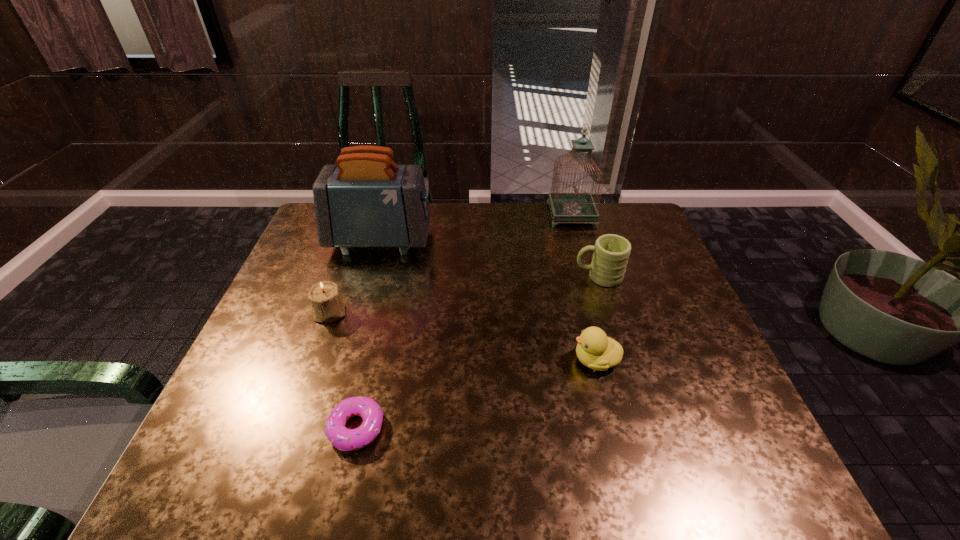
Where is `vacant region between the doughnut and the second shortest object`? vacant region between the doughnut and the second shortest object is located at coordinates (476, 394).

Where is `vacant region between the birdcage and the mug`? The width and height of the screenshot is (960, 540). vacant region between the birdcage and the mug is located at coordinates (585, 246).

Where is `free space between the birdcage and the duckling`? The image size is (960, 540). free space between the birdcage and the duckling is located at coordinates (584, 287).

Identify which object is located as the third nearest to the toaster. Please provide its 2D coordinates. Your answer should be formatted as a tuple, i.e. [(x, y)], where the tuple contains the x and y coordinates of a point satisfying the conditions above.

[(611, 253)]

The image size is (960, 540). In order to click on object that is the second closest one to the second shortest object in this screenshot , I will do `click(341, 437)`.

The image size is (960, 540). Identify the location of free spot that satisfies the following two spatial constraints: 1. on the front-facing side of the toaster; 2. on the back side of the nearest object. (326, 428).

Locate an element on the screen. This screenshot has height=540, width=960. vacant space that satisfies the following two spatial constraints: 1. on the front side of the candle_holder; 2. on the left side of the shortest object is located at coordinates (287, 428).

Image resolution: width=960 pixels, height=540 pixels. In order to click on free space that satisfies the following two spatial constraints: 1. on the side of the fourth nearest object with the handle; 2. on the front side of the fourth farthest object in this screenshot , I will do `click(610, 313)`.